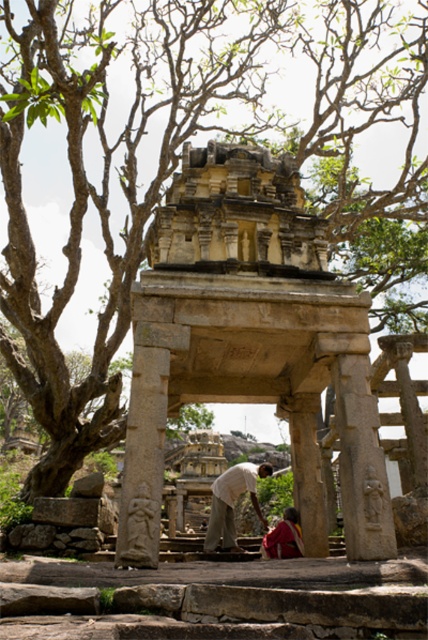
You are a photographer standing at the edge of the ancient stone structure. You want to capture a photo of the light brown cotton shirt at center and the red fabric cloth at center in the same frame. Given that your camera has a maximum focus range of 10 feet, will both subjects be in focus?

The distance between the light brown cotton shirt at center and the red fabric cloth at center is 9.54 feet, which is within the camera maximum focus range of 10 feet. Therefore, both subjects will be in focus.

You are an archaeologist examining the ancient site. You notice the stone carved temple at center and the red fabric cloth at center. Which object is located to the left of the other?

A: The stone carved temple at center is positioned on the left side of red fabric cloth at center.